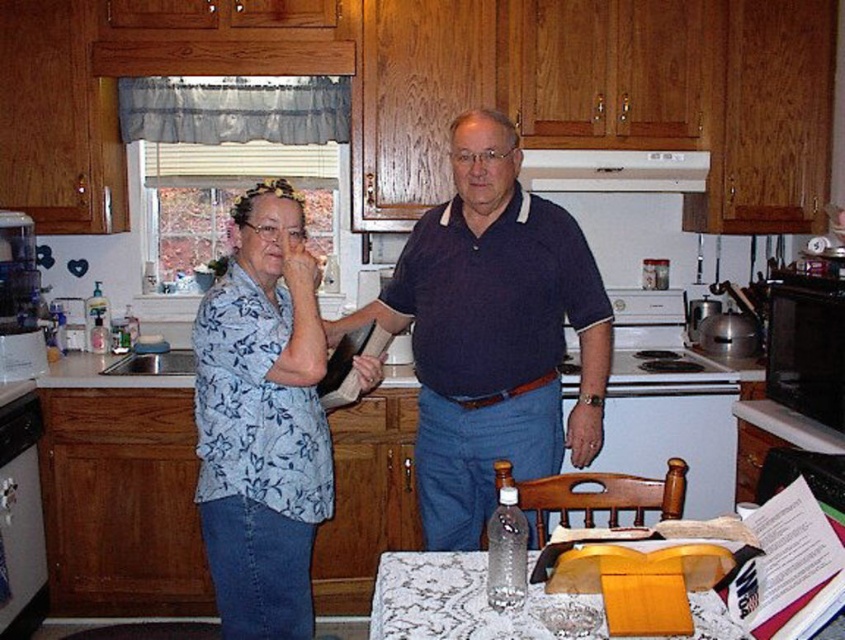
Question: Which object is positioned farthest from the white glossy dishwasher at lower left?

Choices:
 (A) blue floral shirt at center
 (B) dark blue polo shirt at center
 (C) clear plastic bottle at center
 (D) clear plastic bottle at left

Answer: (C)

Question: Can you confirm if white glossy dishwasher at lower left is bigger than clear plastic bottle at center?

Choices:
 (A) no
 (B) yes

Answer: (B)

Question: Based on their relative distances, which object is nearer to the clear plastic bottle at left?

Choices:
 (A) white glossy exhaust hood at upper center
 (B) dark blue polo shirt at center

Answer: (B)

Question: Can you confirm if blue floral shirt at center is positioned below white glossy exhaust hood at upper center?

Choices:
 (A) no
 (B) yes

Answer: (B)

Question: Among these points, which one is farthest from the camera?

Choices:
 (A) (503, 481)
 (B) (571, 168)
 (C) (251, 522)
 (D) (494, 273)

Answer: (B)

Question: Can you confirm if white glossy exhaust hood at upper center is smaller than clear plastic bottle at left?

Choices:
 (A) no
 (B) yes

Answer: (A)